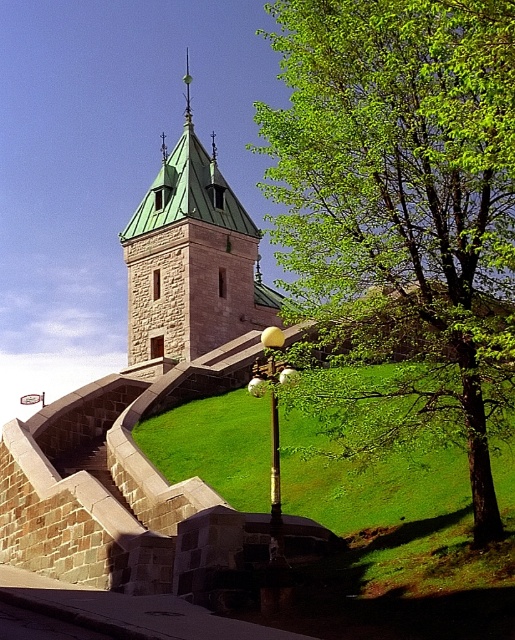
You are standing at the base of the green stone tower at center and want to take a photo of the green leafy tree at right. Which direction should you face to ensure the tree is fully visible in your camera frame?

The green leafy tree at right is below green stone tower at center, so you should face downward to ensure the tree is fully visible in your camera frame.

You are standing at the base of the historic stone tower and want to reach a specific point marked at coordinates point [428,499]. If you walk directly towards the tower, will you arrive at that point before reaching the tower itself?

The distance of point [428,499] from viewer is 39.77 meters. Since the tower is situated atop a grassy hill and the point is located at that distance, you would reach the point before arriving at the tower itself.